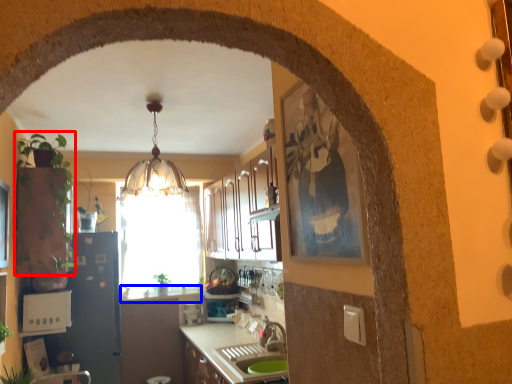
Question: Which point is closer to the camera, plant (highlighted by a red box) or counter top (highlighted by a blue box)?

Choices:
 (A) plant
 (B) counter top

Answer: (A)